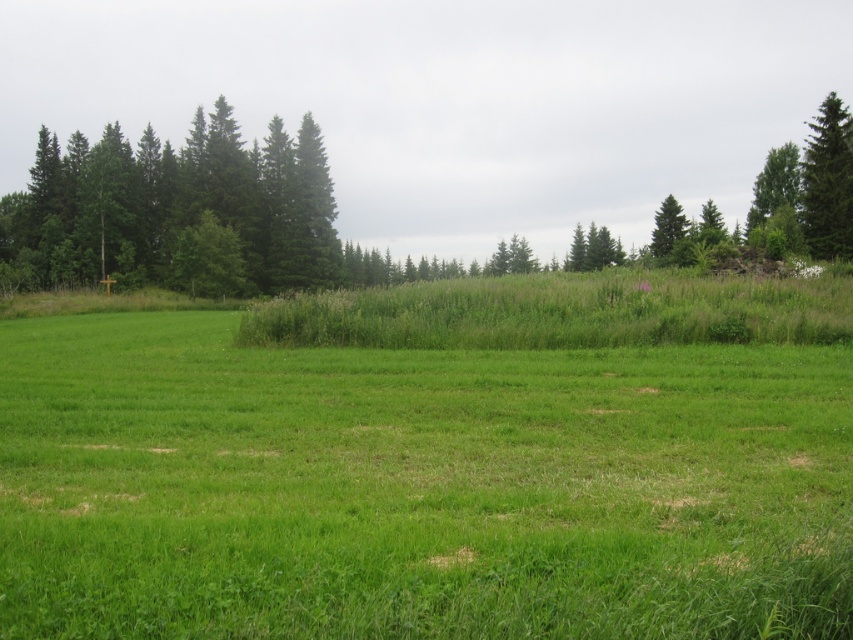
Question: Which point is closer to the camera?

Choices:
 (A) green grassy pasture at center
 (B) green matte tree at upper center
 (C) green textured tree at upper right

Answer: (A)

Question: Is green grassy pasture at center closer to the viewer compared to green textured tree at right?

Choices:
 (A) yes
 (B) no

Answer: (A)

Question: Which object is closer to the camera taking this photo?

Choices:
 (A) green matte tree at upper center
 (B) green textured tree at upper right
 (C) green leafy tree at upper right

Answer: (C)

Question: Is the position of green textured tree at right less distant than that of green matte tree at upper center?

Choices:
 (A) no
 (B) yes

Answer: (B)

Question: Can you confirm if green matte tree at left is wider than green matte tree at upper center?

Choices:
 (A) yes
 (B) no

Answer: (A)

Question: Among these objects, which one is nearest to the camera?

Choices:
 (A) green textured tree at right
 (B) green grassy pasture at center

Answer: (B)